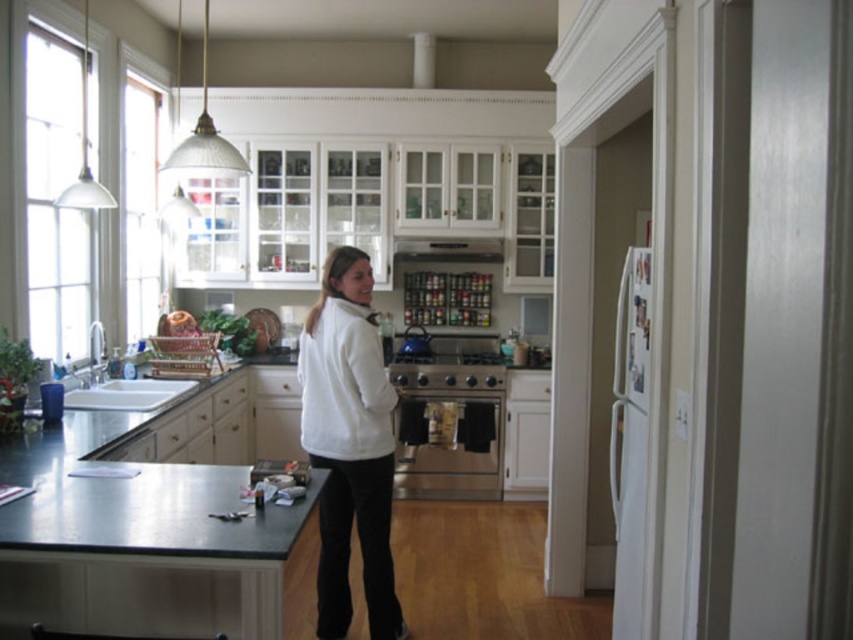
Which is behind, point (618, 524) or point (412, 244)?

Positioned behind is point (412, 244).

Can you confirm if white matte refrigerator at right is taller than satin silver metal exhaust hood at upper center?

Correct, white matte refrigerator at right is much taller as satin silver metal exhaust hood at upper center.

Measure the distance between point (631, 548) and camera.

Point (631, 548) is 8.71 feet from camera.

Where is `white matte refrigerator at right`? The image size is (853, 640). white matte refrigerator at right is located at coordinates (630, 438).

Consider the image. Is satin silver oven at center taller than white fleece sweatshirt at center?

Yes, satin silver oven at center is taller than white fleece sweatshirt at center.

Can you confirm if satin silver oven at center is positioned above white fleece sweatshirt at center?

No.

Is point (450, 420) positioned after point (358, 388)?

Yes, it is.

In order to click on satin silver oven at center in this screenshot , I will do `click(450, 426)`.

Can you confirm if white fleece sweater at center is positioned above satin silver metal exhaust hood at upper center?

No.

Does white fleece sweater at center appear under satin silver metal exhaust hood at upper center?

Correct, white fleece sweater at center is located below satin silver metal exhaust hood at upper center.

Which is in front, point (378, 474) or point (434, 253)?

Point (378, 474) is more forward.

Locate an element on the screen. The height and width of the screenshot is (640, 853). white fleece sweater at center is located at coordinates (349, 444).